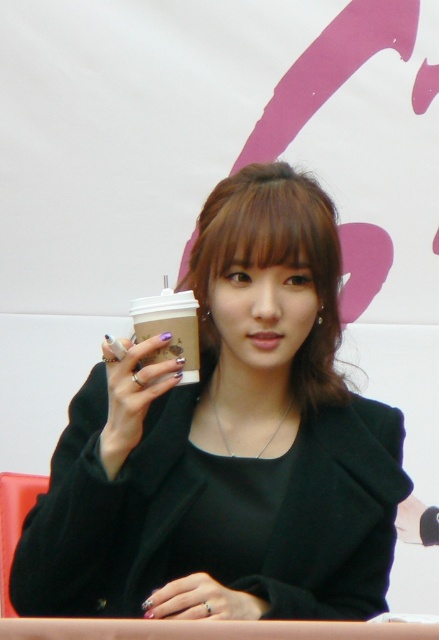
Does matte black jacket at center have a greater height compared to matte plastic cup at center-left?

Indeed, matte black jacket at center has a greater height compared to matte plastic cup at center-left.

Is point (315, 228) behind point (133, 416)?

Yes, point (315, 228) is farther from viewer.

Locate an element on the screen. matte black jacket at center is located at coordinates (273, 262).

Can you confirm if smooth wooden table at lower center is taller than nail polish at center?

Indeed, smooth wooden table at lower center has a greater height compared to nail polish at center.

Who is higher up, smooth wooden table at lower center or nail polish at center?

nail polish at center

The width and height of the screenshot is (439, 640). What are the coordinates of `smooth wooden table at lower center` in the screenshot? It's located at (208, 628).

Is matte plastic cup at center positioned before black matte hand at lower right?

Yes.

Locate an element on the screen. The width and height of the screenshot is (439, 640). matte plastic cup at center is located at coordinates (226, 445).